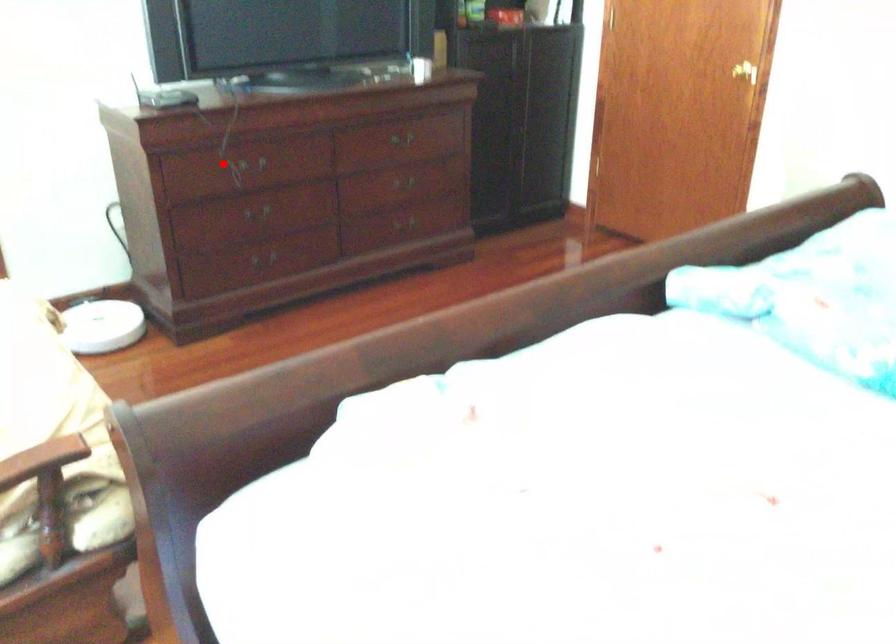
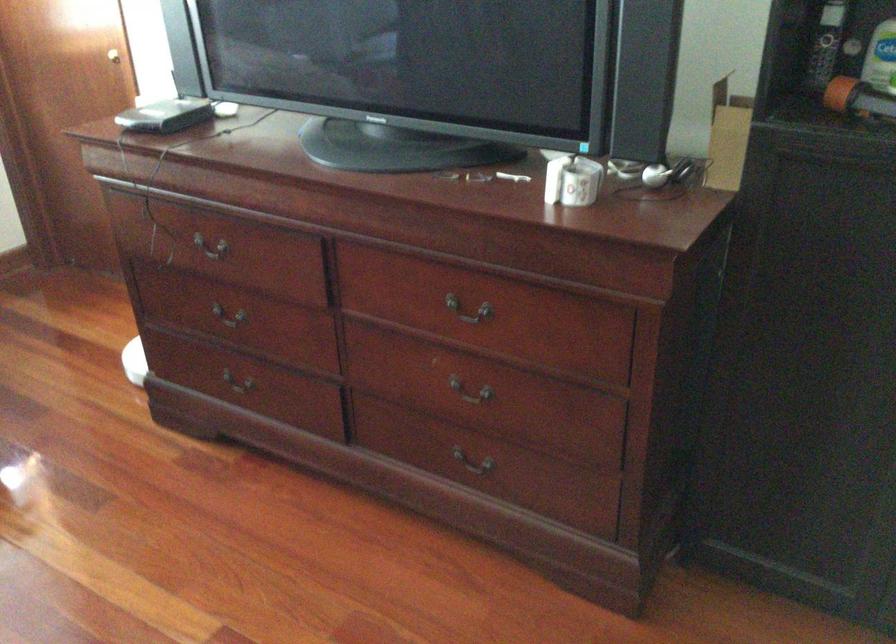
Question: I am providing you with two images of the same scene from different viewpoints. Given a red point in image1, look at the same physical point in image2. Is it:

Choices:
 (A) Closer to the viewpoint
 (B) Farther from the viewpoint

Answer: (A)